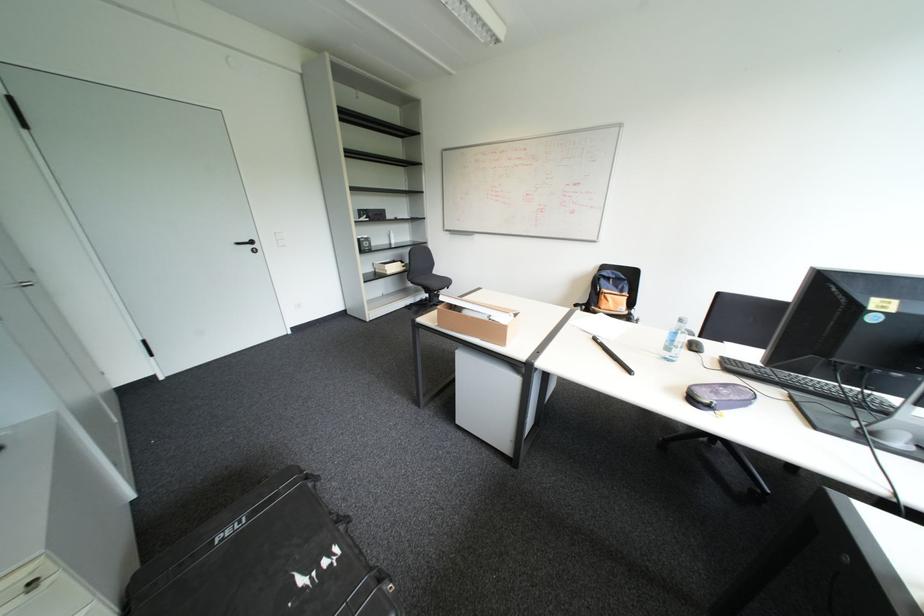
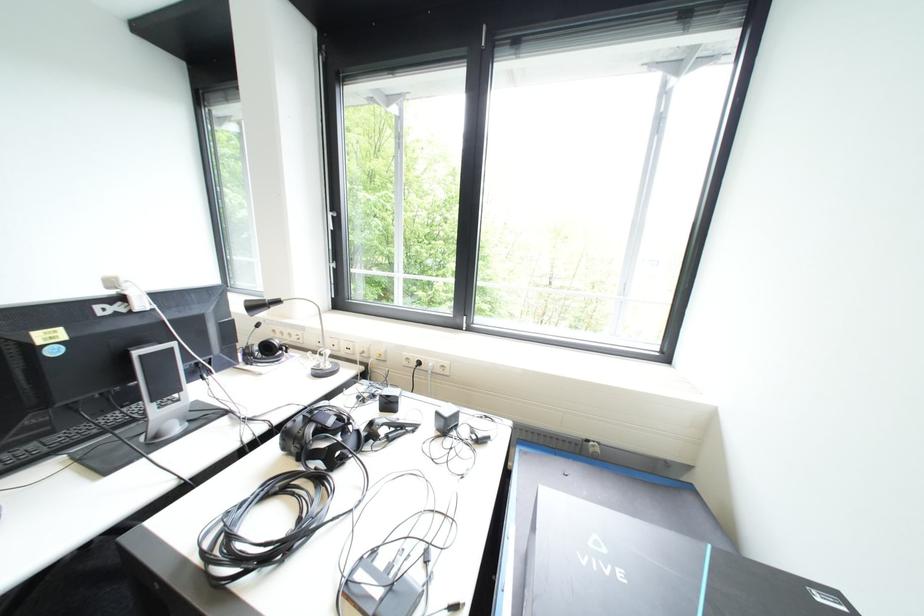
The first image is from the beginning of the video and the second image is from the end. How did the camera likely rotate when shooting the video?

The rotation direction of the camera is right-down.